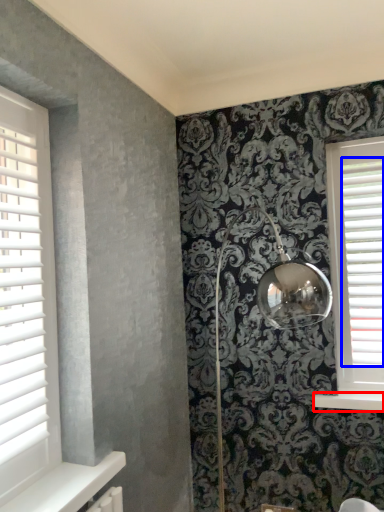
Question: Among these objects, which one is farthest to the camera, window sill (highlighted by a red box) or blind (highlighted by a blue box)?

Choices:
 (A) window sill
 (B) blind

Answer: (B)